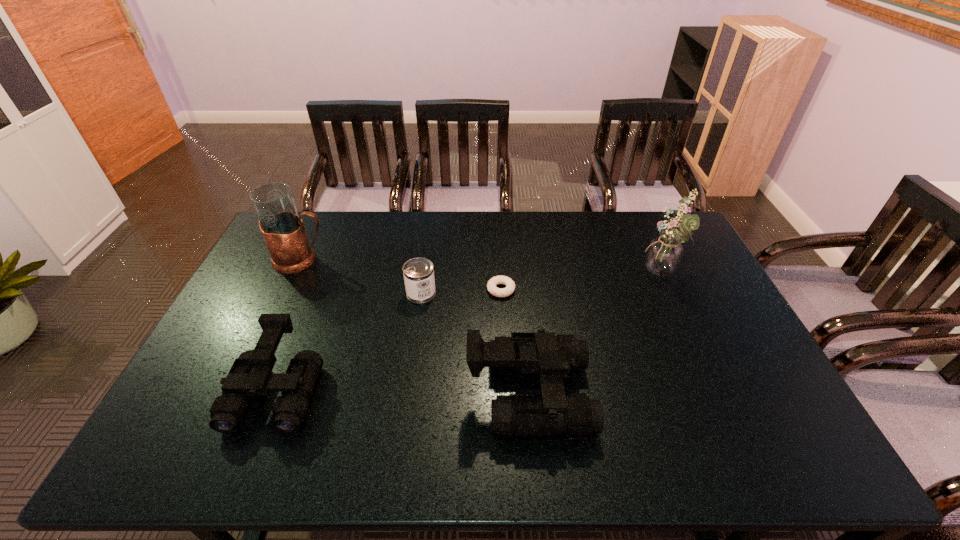
Locate an element on the screen. free space located 0.160m with the handle on the side of the pitcher is located at coordinates (374, 260).

This screenshot has width=960, height=540. Identify the location of free space located 0.070m on the right of the shortest object. (537, 289).

Where is `free region located 0.060m on the front-facing side of the bouquet`? free region located 0.060m on the front-facing side of the bouquet is located at coordinates (623, 275).

Locate an element on the screen. vacant area located on the front-facing side of the bouquet is located at coordinates (525, 275).

The width and height of the screenshot is (960, 540). Find the location of `free spot located on the front-facing side of the bouquet`. free spot located on the front-facing side of the bouquet is located at coordinates [x=626, y=275].

Where is `vacant region located on the front of the third object from left to right`? This screenshot has height=540, width=960. vacant region located on the front of the third object from left to right is located at coordinates (403, 416).

Locate an element on the screen. The image size is (960, 540). object that is at the far edge is located at coordinates (282, 228).

I want to click on binoculars situated at the left edge, so click(250, 375).

Find the location of `pitcher that is at the left edge`. pitcher that is at the left edge is located at coordinates (282, 228).

You are a GUI agent. You are given a task and a screenshot of the screen. Output one action in this format:
    pyautogui.click(x=<x>, y=<y>)
    Task: Click on the object located in the right edge section of the desktop
    The height and width of the screenshot is (540, 960).
    Given the screenshot: What is the action you would take?
    pyautogui.click(x=663, y=256)